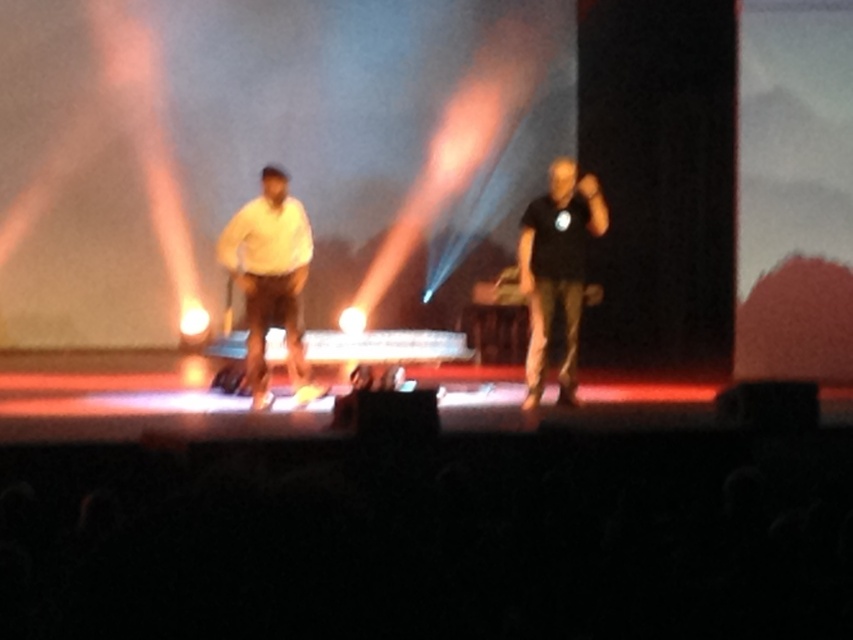
Question: Is white matte shirt at center smaller than black matte shirt at center?

Choices:
 (A) no
 (B) yes

Answer: (A)

Question: Can you confirm if white matte shirt at center is bigger than black matte shirt at center?

Choices:
 (A) no
 (B) yes

Answer: (B)

Question: Which point appears farthest from the camera in this image?

Choices:
 (A) (271, 394)
 (B) (566, 269)

Answer: (A)

Question: From the image, what is the correct spatial relationship of white matte shirt at center in relation to black matte shirt at center?

Choices:
 (A) below
 (B) above

Answer: (A)